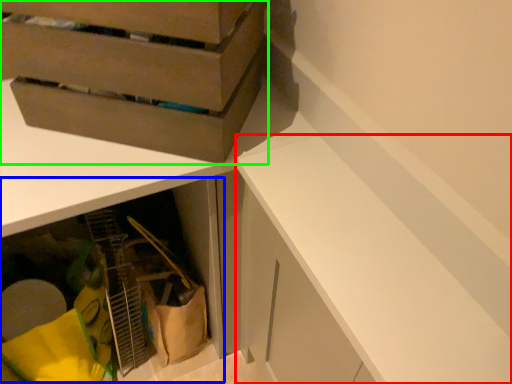
Question: Based on their relative distances, which object is nearer to cabinetry (highlighted by a red box)? Choose from cabinetry (highlighted by a blue box) and cardboard box (highlighted by a green box).

Choices:
 (A) cabinetry
 (B) cardboard box

Answer: (B)